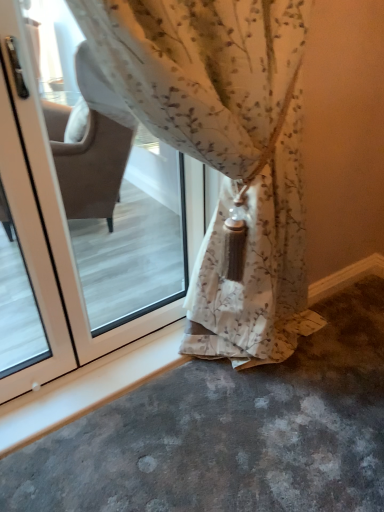
Locate an element on the screen. Image resolution: width=384 pixels, height=512 pixels. white glossy screen door at left is located at coordinates coord(29,209).

What do you see at coordinates (29, 209) in the screenshot? The height and width of the screenshot is (512, 384). I see `white glossy screen door at left` at bounding box center [29, 209].

Describe the element at coordinates (225, 151) in the screenshot. This screenshot has height=512, width=384. I see `floral fabric curtain at center` at that location.

Locate an element on the screen. The height and width of the screenshot is (512, 384). floral fabric curtain at center is located at coordinates (225, 151).

The image size is (384, 512). I want to click on white glossy screen door at left, so click(29, 209).

Looking at this image, considering the positions of objects white glossy screen door at left and floral fabric curtain at center in the image provided, who is more to the left, white glossy screen door at left or floral fabric curtain at center?

white glossy screen door at left.

Does white glossy screen door at left lie behind floral fabric curtain at center?

Yes, white glossy screen door at left is behind floral fabric curtain at center.

Which is nearer, (20, 136) or (286, 213)?

The point (20, 136) is closer.

From the image's perspective, which is below, white glossy screen door at left or floral fabric curtain at center?

white glossy screen door at left is shown below in the image.

From a real-world perspective, is white glossy screen door at left above or below floral fabric curtain at center?

In terms of real-world spatial position, white glossy screen door at left is below floral fabric curtain at center.

Looking at their sizes, would you say white glossy screen door at left is wider or thinner than floral fabric curtain at center?

Clearly, white glossy screen door at left has less width compared to floral fabric curtain at center.

Who is taller, white glossy screen door at left or floral fabric curtain at center?

With more height is floral fabric curtain at center.

Which of these two, white glossy screen door at left or floral fabric curtain at center, is smaller?

Smaller between the two is white glossy screen door at left.

Is white glossy screen door at left not within floral fabric curtain at center?

Yes, white glossy screen door at left is not within floral fabric curtain at center.

Would you say white glossy screen door at left is a long distance from floral fabric curtain at center?

No, white glossy screen door at left is in close proximity to floral fabric curtain at center.

Is white glossy screen door at left oriented away from floral fabric curtain at center?

No, white glossy screen door at left's orientation is not away from floral fabric curtain at center.

How many degrees apart are the facing directions of white glossy screen door at left and floral fabric curtain at center?

There is a 0.796-degree angle between the facing directions of white glossy screen door at left and floral fabric curtain at center.

Measure the distance between white glossy screen door at left and floral fabric curtain at center.

white glossy screen door at left is 20.76 inches from floral fabric curtain at center.

Locate an element on the screen. The width and height of the screenshot is (384, 512). curtain that is above the white glossy screen door at left (from the image's perspective) is located at coordinates pyautogui.click(x=225, y=151).

Which is more to the left, floral fabric curtain at center or white glossy screen door at left?

Positioned to the left is white glossy screen door at left.

Relative to white glossy screen door at left, is floral fabric curtain at center in front or behind?

Clearly, floral fabric curtain at center is in front of white glossy screen door at left.

Which is farther, (x=99, y=47) or (x=6, y=50)?

The point (x=6, y=50) is farther from the camera.

Based on the photo, from the image's perspective, which one is positioned higher, floral fabric curtain at center or white glossy screen door at left?

floral fabric curtain at center appears higher in the image.

From a real-world perspective, is floral fabric curtain at center below white glossy screen door at left?

No, from a real-world perspective, floral fabric curtain at center is not below white glossy screen door at left.

In terms of width, does floral fabric curtain at center look wider or thinner when compared to white glossy screen door at left?

floral fabric curtain at center is wider than white glossy screen door at left.

Is floral fabric curtain at center taller or shorter than white glossy screen door at left?

Considering their sizes, floral fabric curtain at center has more height than white glossy screen door at left.

Which of these two, floral fabric curtain at center or white glossy screen door at left, is bigger?

floral fabric curtain at center is bigger.

Is white glossy screen door at left completely or partially inside floral fabric curtain at center?

No, white glossy screen door at left is not inside floral fabric curtain at center.

Is floral fabric curtain at center far away from white glossy screen door at left?

Actually, floral fabric curtain at center and white glossy screen door at left are a little close together.

Could you tell me if floral fabric curtain at center is facing white glossy screen door at left?

No, floral fabric curtain at center is not facing towards white glossy screen door at left.

Consider the image. Can you tell me how much floral fabric curtain at center and white glossy screen door at left differ in facing direction?

The angle between the facing direction of floral fabric curtain at center and the facing direction of white glossy screen door at left is 0.796 degrees.

At what (x,y) coordinates should I click in order to perform the action: click on screen door below the floral fabric curtain at center (from a real-world perspective). Please return your answer as a coordinate pair (x, y). The width and height of the screenshot is (384, 512). Looking at the image, I should click on (x=29, y=209).

At what (x,y) coordinates should I click in order to perform the action: click on screen door located below the floral fabric curtain at center (from the image's perspective). Please return your answer as a coordinate pair (x, y). Looking at the image, I should click on (29, 209).

You are a GUI agent. You are given a task and a screenshot of the screen. Output one action in this format:
    pyautogui.click(x=<x>, y=<y>)
    Task: Click on the curtain that is on the right side of white glossy screen door at left
    
    Given the screenshot: What is the action you would take?
    pyautogui.click(x=225, y=151)